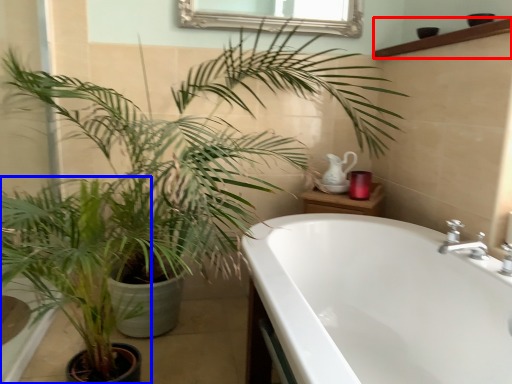
Question: Among these objects, which one is nearest to the camera, balustrade (highlighted by a red box) or houseplant (highlighted by a blue box)?

Choices:
 (A) balustrade
 (B) houseplant

Answer: (B)